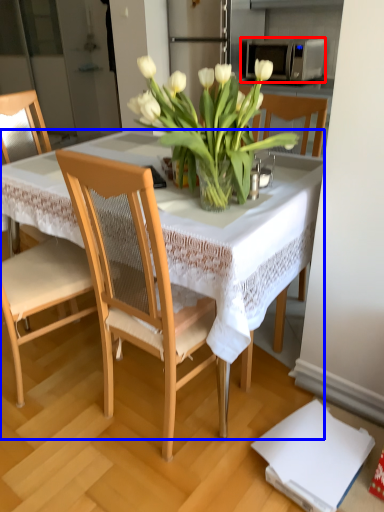
Question: Which of the following is the farthest to the observer, microwave oven (highlighted by a red box) or table (highlighted by a blue box)?

Choices:
 (A) microwave oven
 (B) table

Answer: (A)